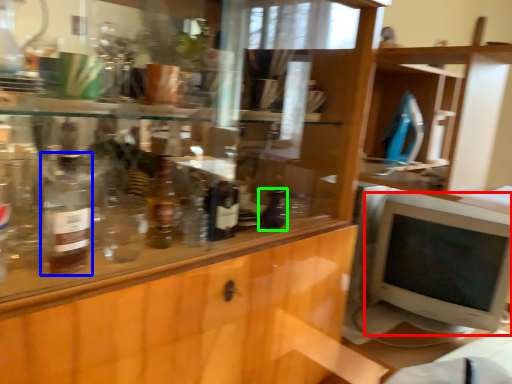
Question: Which is farther away from computer monitor (highlighted by a red box)? bottle (highlighted by a blue box) or bottle (highlighted by a green box)?

Choices:
 (A) bottle
 (B) bottle

Answer: (A)